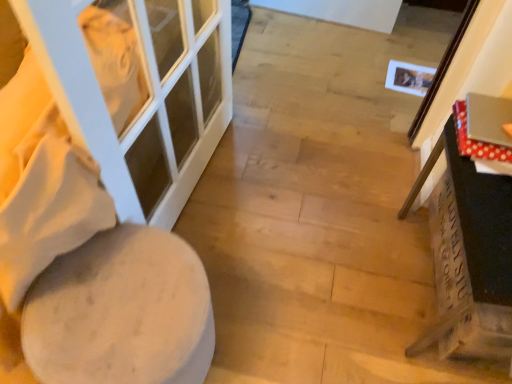
This screenshot has height=384, width=512. Identify the location of white textured glass door at left. (146, 99).

What do you see at coordinates (146, 99) in the screenshot? The image size is (512, 384). I see `white textured glass door at left` at bounding box center [146, 99].

Locate an element on the screen. This screenshot has width=512, height=384. white textured glass door at left is located at coordinates (146, 99).